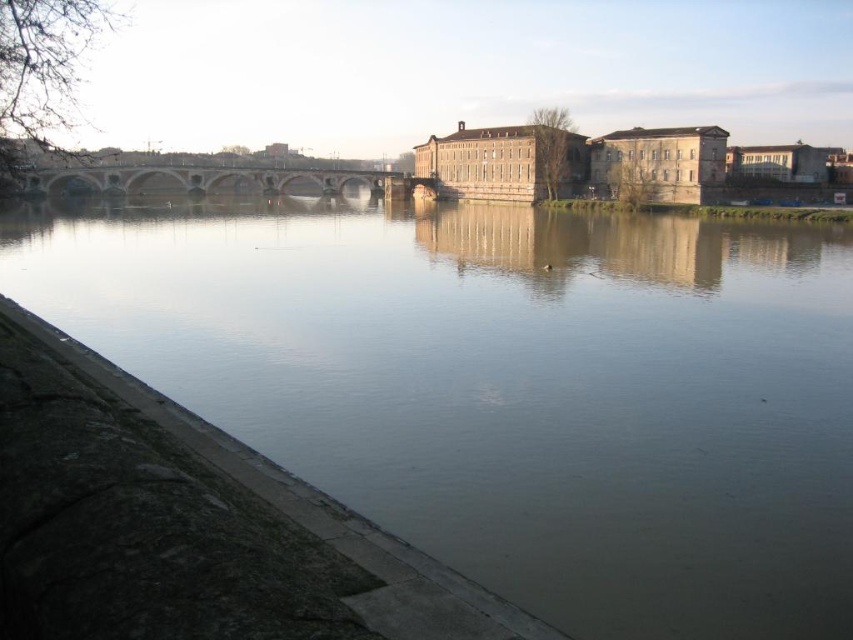
Question: Does greenish water at lower left appear over brown stone bridge at center?

Choices:
 (A) no
 (B) yes

Answer: (A)

Question: Is greenish water at lower left to the left of brown stone bridge at center from the viewer's perspective?

Choices:
 (A) yes
 (B) no

Answer: (B)

Question: Which point is closer to the camera?

Choices:
 (A) (35, 186)
 (B) (642, 387)

Answer: (B)

Question: Can you confirm if greenish water at lower left is positioned to the left of brown stone bridge at center?

Choices:
 (A) yes
 (B) no

Answer: (B)